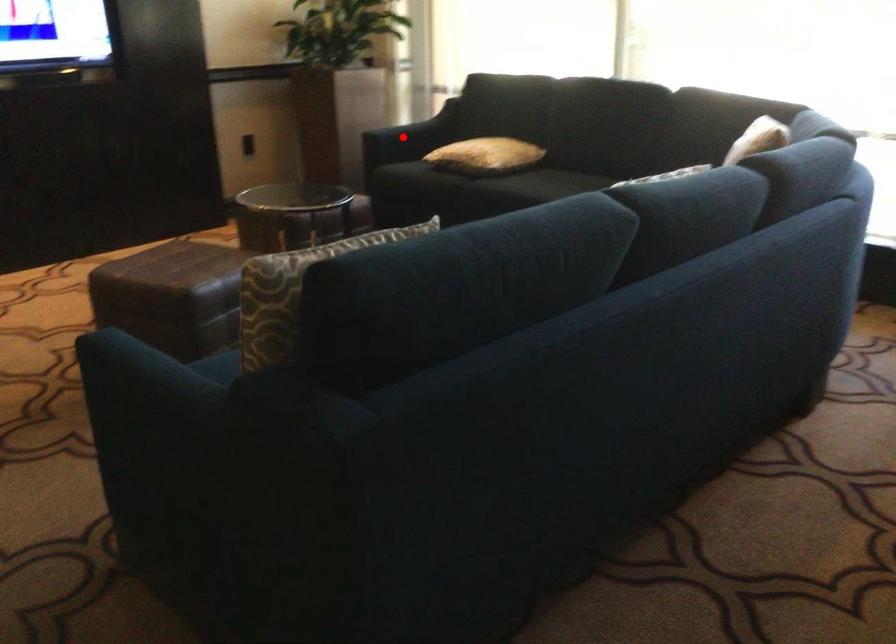
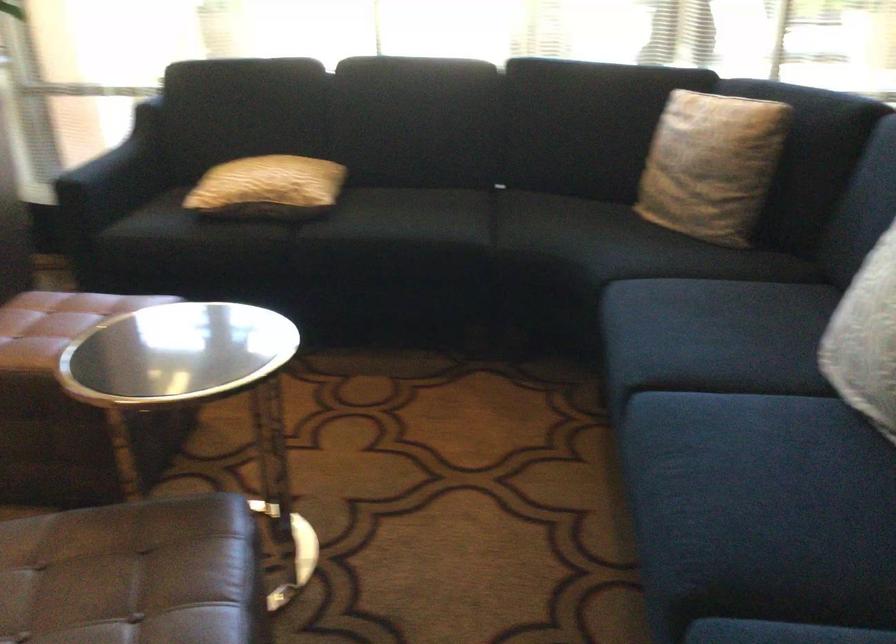
Question: I am providing you with two images of the same scene from different viewpoints. Image1 has a red point marked. In image2, the corresponding 3D location appears at what relative position? Reply with the corresponding letter.

Choices:
 (A) Closer
 (B) Farther

Answer: (A)